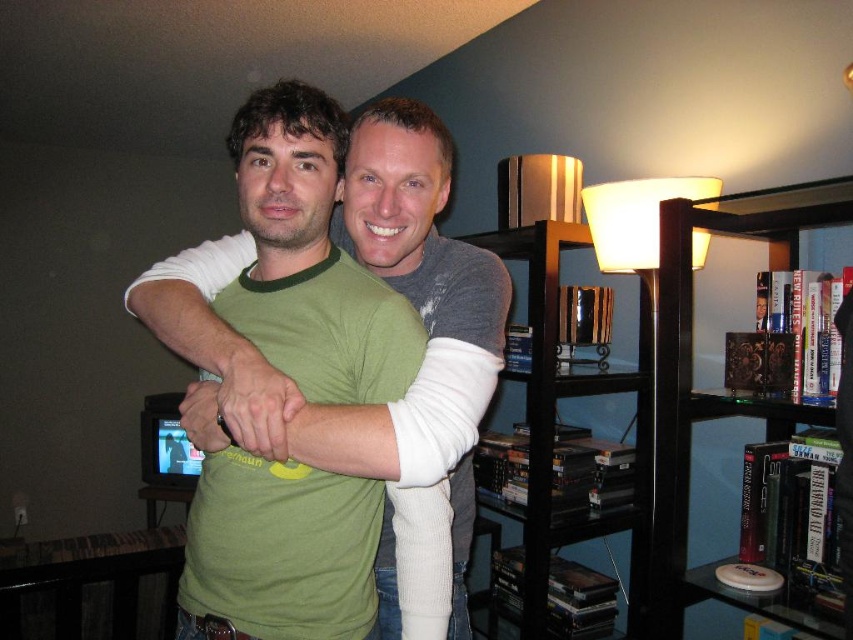
Question: Which of these objects is positioned closest to the green cotton t-shirt at center?

Choices:
 (A) green matte shirt at center
 (B) transparent glass bookcase at right

Answer: (A)

Question: Can you confirm if green cotton t-shirt at center is bigger than black glossy bookshelf at right?

Choices:
 (A) no
 (B) yes

Answer: (A)

Question: Where is black glossy bookshelf at right located in relation to green matte shirt at center in the image?

Choices:
 (A) left
 (B) right

Answer: (B)

Question: From the image, what is the correct spatial relationship of green cotton t-shirt at center in relation to black glossy bookshelf at right?

Choices:
 (A) right
 (B) left

Answer: (B)

Question: Which object is positioned farthest from the green cotton t-shirt at center?

Choices:
 (A) transparent glass bookcase at right
 (B) black glossy bookshelf at right
 (C) green matte shirt at center

Answer: (B)

Question: Estimate the real-world distances between objects in this image. Which object is closer to the green cotton t-shirt at center?

Choices:
 (A) transparent glass bookcase at right
 (B) black glossy bookshelf at right

Answer: (A)